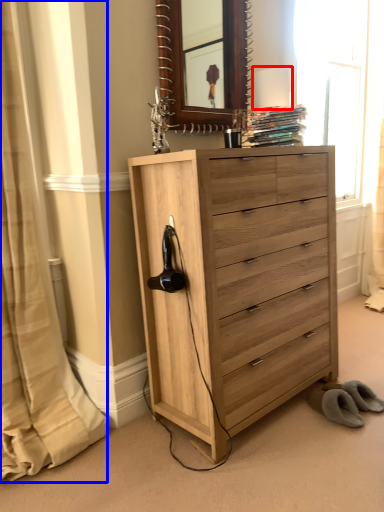
Question: Which object is closer to the camera taking this photo, table lamp (highlighted by a red box) or curtain (highlighted by a blue box)?

Choices:
 (A) table lamp
 (B) curtain

Answer: (B)